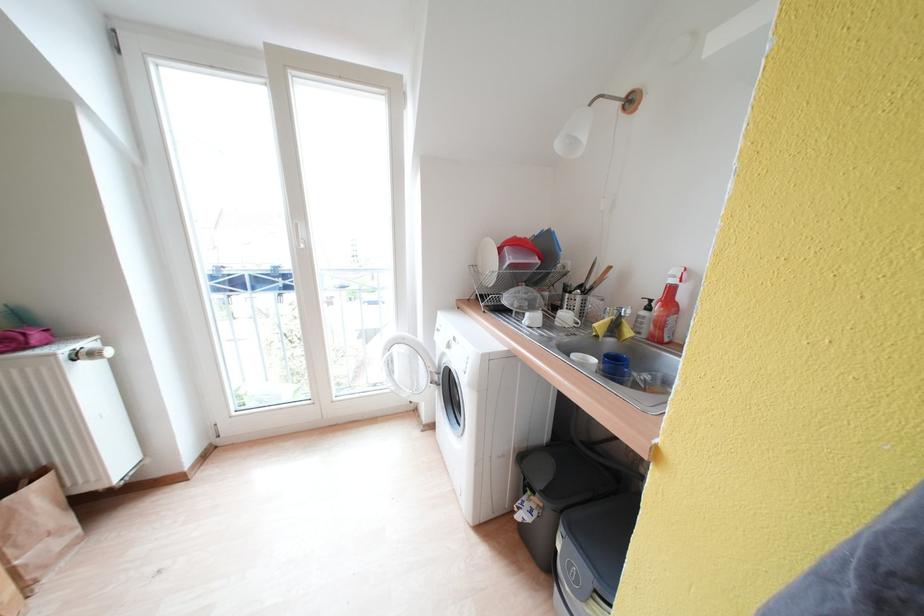
The image size is (924, 616). Find the location of `red plastic container`. red plastic container is located at coordinates (517, 254).